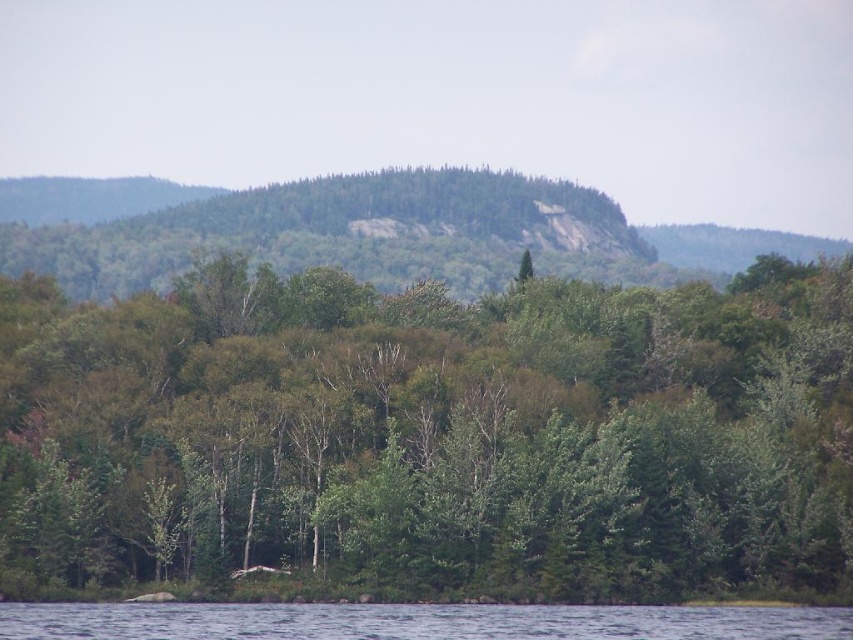
Question: In this image, where is green leafy trees at center located relative to clear water at lower center?

Choices:
 (A) left
 (B) right

Answer: (A)

Question: Which object appears closest to the camera in this image?

Choices:
 (A) clear water at lower center
 (B) green leafy trees at center

Answer: (A)

Question: Can you confirm if green leafy trees at center is positioned to the left of clear water at lower center?

Choices:
 (A) no
 (B) yes

Answer: (B)

Question: Does green leafy trees at center have a greater width compared to clear water at lower center?

Choices:
 (A) no
 (B) yes

Answer: (B)

Question: Which of the following is the farthest from the observer?

Choices:
 (A) (489, 632)
 (B) (345, 586)

Answer: (B)